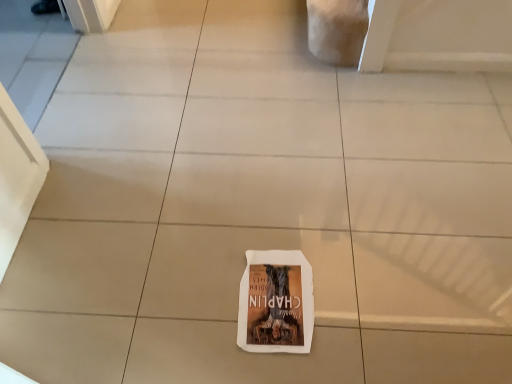
Identify the location of vacant space to the right of white paper flyer at center. coord(353,294).